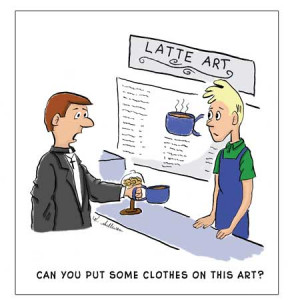
I want to click on cup, so click(171, 122).